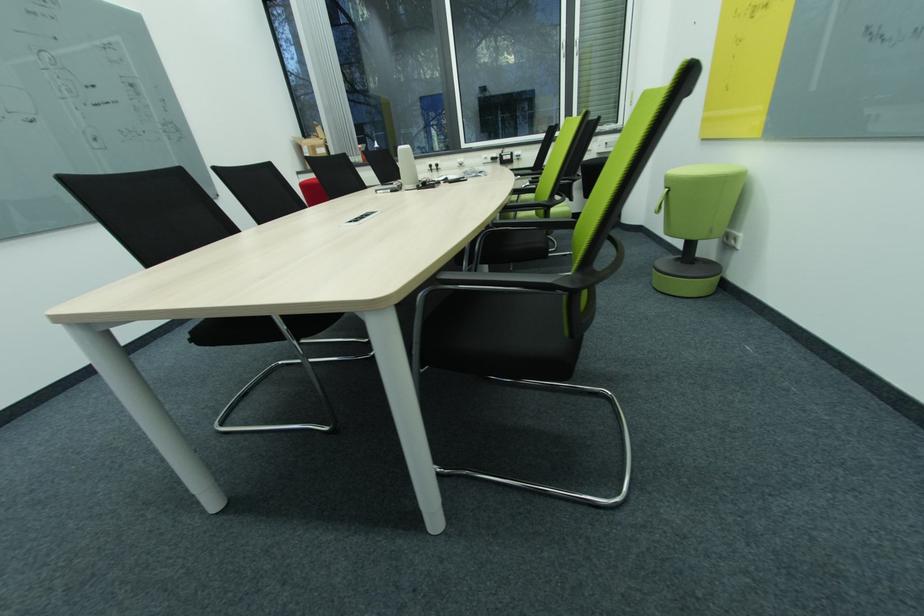
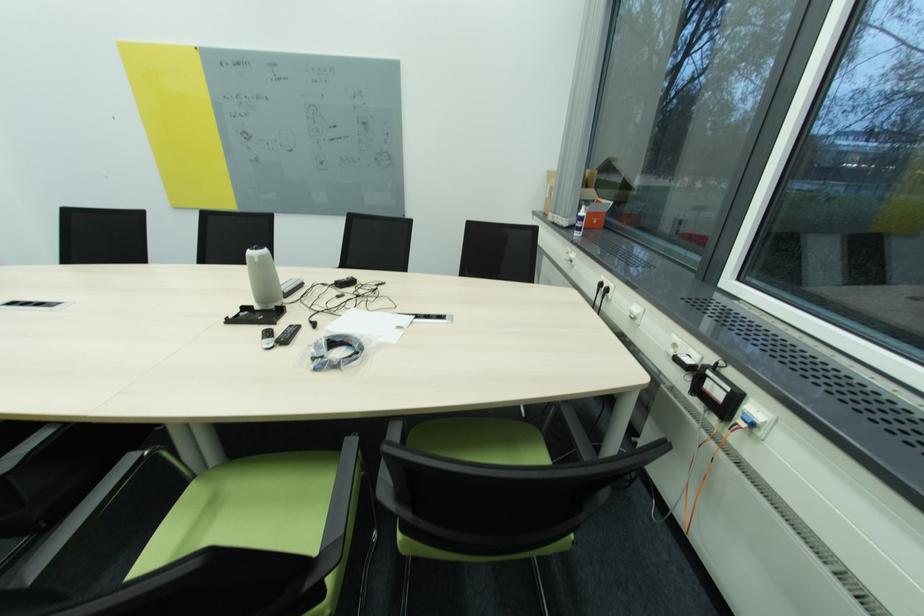
Locate, in the second image, the point that corresponds to [435,167] in the first image.

(604, 286)